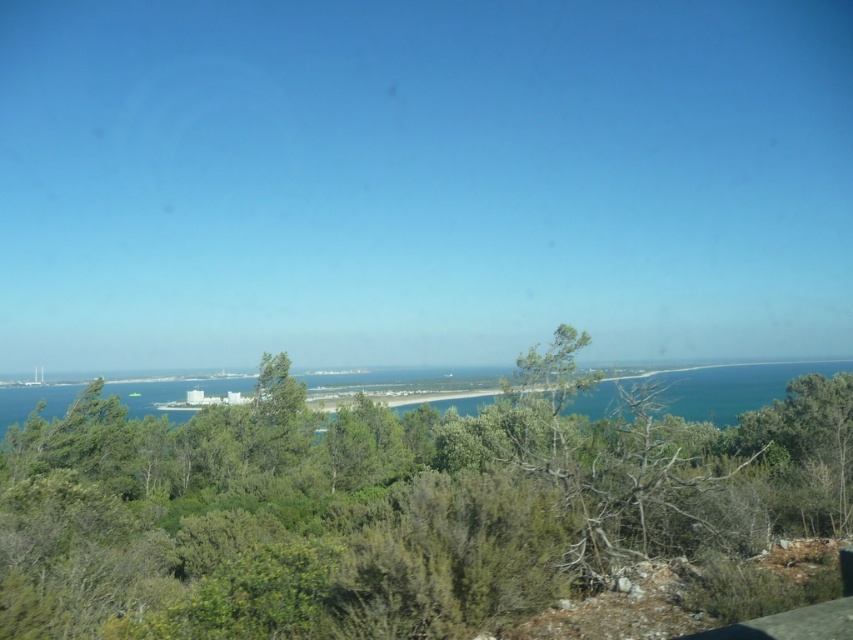
You are standing on the beach and see the green leafy tree at center and the blue water at center. Which object is located to the right side?

The blue water at center is located to the right side of the green leafy tree at center.

You are standing at the center of the image and want to locate the green leafy tree at center. Which direction should you look to find it?

The green leafy tree at center is located at point coordinates (387, 506), so you should look towards the center of the image to find it.